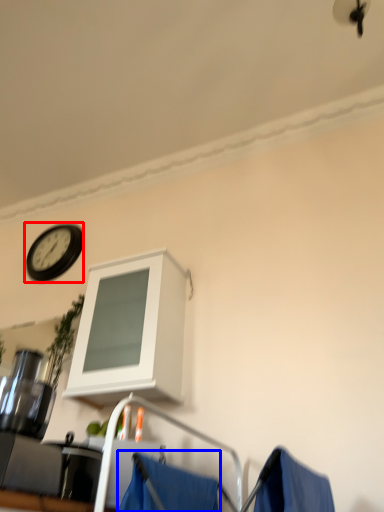
Question: Which object is further to the camera taking this photo, wall clock (highlighted by a red box) or curtain (highlighted by a blue box)?

Choices:
 (A) wall clock
 (B) curtain

Answer: (A)